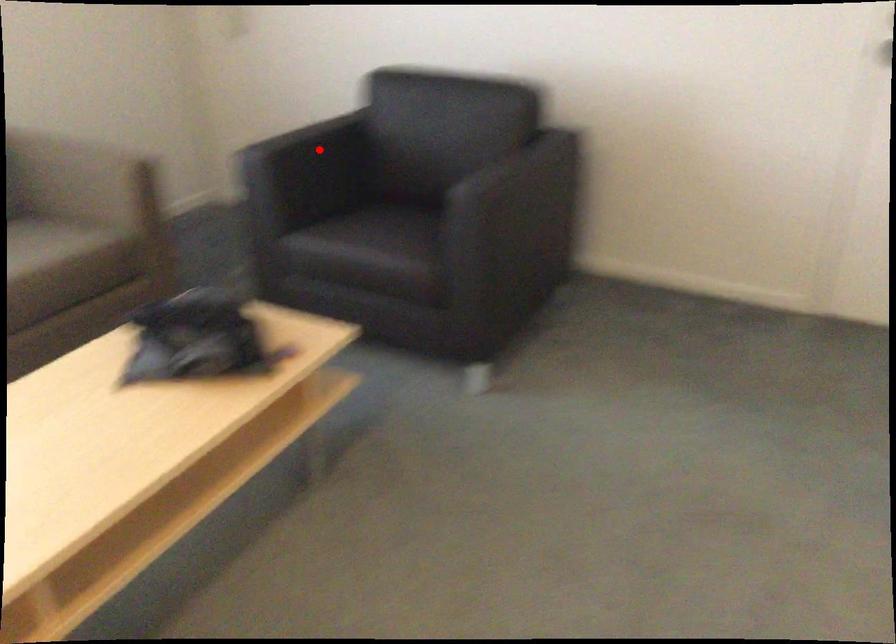
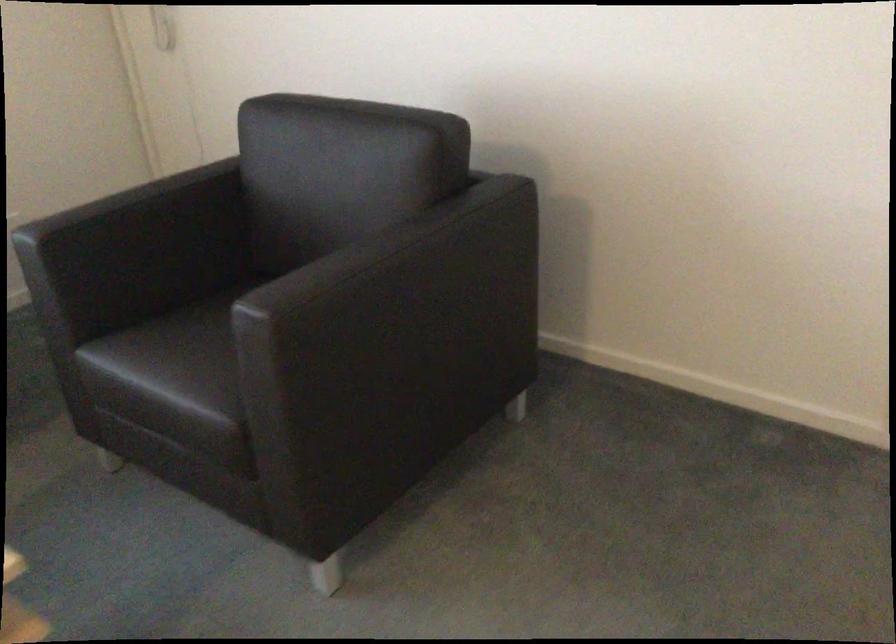
In the second image, find the point that corresponds to the highlighted location in the first image.

(147, 225)